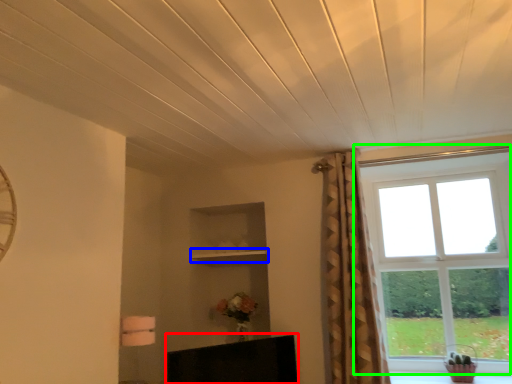
Question: Based on their relative distances, which object is nearer to furniture (highlighted by a red box)? Choose from shelf (highlighted by a blue box) and window (highlighted by a green box).

Choices:
 (A) shelf
 (B) window

Answer: (A)